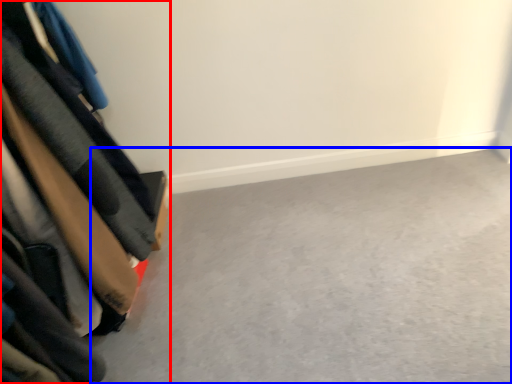
Question: Which point is further to the camera, furniture (highlighted by a red box) or concrete (highlighted by a blue box)?

Choices:
 (A) furniture
 (B) concrete

Answer: (B)